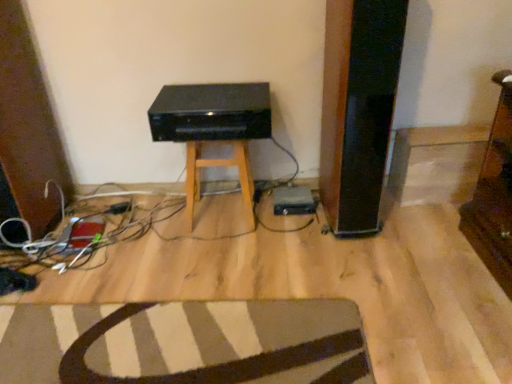
The image size is (512, 384). I want to click on vacant area situated below striped fabric rug at lower center (from a real-world perspective), so click(x=144, y=342).